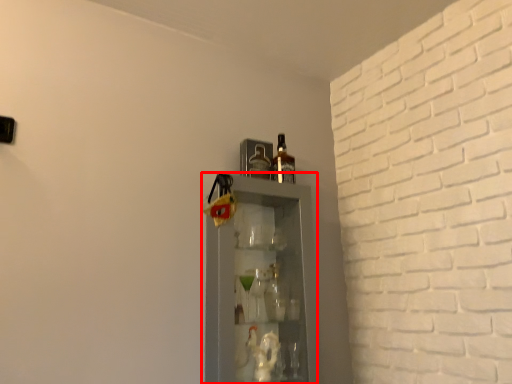
Question: From the image's perspective, considering the relative positions of shelf (annotated by the red box) and bottle in the image provided, where is shelf (annotated by the red box) located with respect to the staircase?

Choices:
 (A) above
 (B) below

Answer: (B)